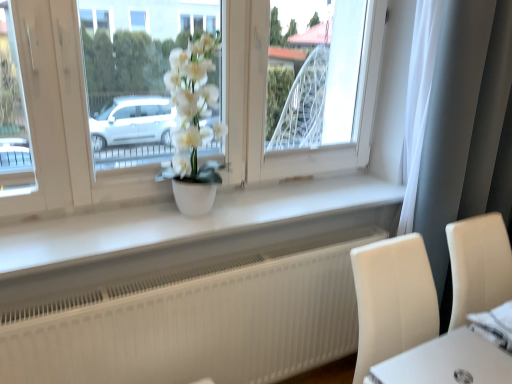
Question: Considering the relative sizes of white matte window sill at center and white matte pot at center in the image provided, is white matte window sill at center bigger than white matte pot at center?

Choices:
 (A) no
 (B) yes

Answer: (A)

Question: From a real-world perspective, is white matte window sill at center physically above white matte pot at center?

Choices:
 (A) no
 (B) yes

Answer: (A)

Question: Can you confirm if white matte window sill at center is positioned to the right of white matte pot at center?

Choices:
 (A) no
 (B) yes

Answer: (B)

Question: Is the depth of white matte window sill at center less than that of white matte pot at center?

Choices:
 (A) no
 (B) yes

Answer: (B)

Question: Is white matte window sill at center thinner than white matte pot at center?

Choices:
 (A) yes
 (B) no

Answer: (B)

Question: Would you say white matte window sill at center is a long distance from white matte pot at center?

Choices:
 (A) yes
 (B) no

Answer: (B)

Question: Is there a large distance between white fabric at lower right and white sheer curtain at right?

Choices:
 (A) yes
 (B) no

Answer: (B)

Question: From a real-world perspective, does white fabric at lower right sit lower than white sheer curtain at right?

Choices:
 (A) yes
 (B) no

Answer: (A)

Question: Does white fabric at lower right come behind white sheer curtain at right?

Choices:
 (A) no
 (B) yes

Answer: (A)

Question: Considering the relative sizes of white fabric at lower right and white sheer curtain at right in the image provided, is white fabric at lower right bigger than white sheer curtain at right?

Choices:
 (A) no
 (B) yes

Answer: (A)

Question: Is white fabric at lower right not within white sheer curtain at right?

Choices:
 (A) no
 (B) yes

Answer: (B)

Question: Does white fabric at lower right have a lesser width compared to white sheer curtain at right?

Choices:
 (A) yes
 (B) no

Answer: (B)

Question: Can you confirm if white fabric at lower right is thinner than white matte pot at center?

Choices:
 (A) no
 (B) yes

Answer: (A)